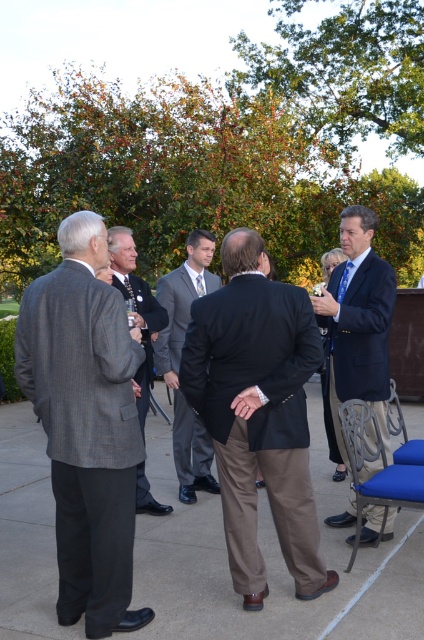
Is point (367, 355) more distant than point (161, 346)?

That is False.

Does point (368, 358) come in front of point (158, 340)?

Yes, point (368, 358) is closer to viewer.

Who is more distant from viewer, (357, 321) or (192, 266)?

Point (192, 266)

Where is `dark blue suit at center`? dark blue suit at center is located at coordinates (357, 323).

Is dark brown suit at center shorter than gray suit at center?

Correct, dark brown suit at center is not as tall as gray suit at center.

Does dark brown suit at center have a lesser width compared to gray suit at center?

No.

Which is in front, point (293, 317) or point (162, 355)?

Point (293, 317)

At what (x,y) coordinates should I click in order to perform the action: click on dark brown suit at center. Please return your answer as a coordinate pair (x, y). The width and height of the screenshot is (424, 640). Looking at the image, I should click on (257, 413).

Which is above, dark brown suit at center or dark blue suit at center?

dark blue suit at center is above.

Who is lower down, dark brown suit at center or dark blue suit at center?

Positioned lower is dark brown suit at center.

Is point (282, 289) more distant than point (379, 284)?

No, it is not.

I want to click on dark brown suit at center, so pos(257,413).